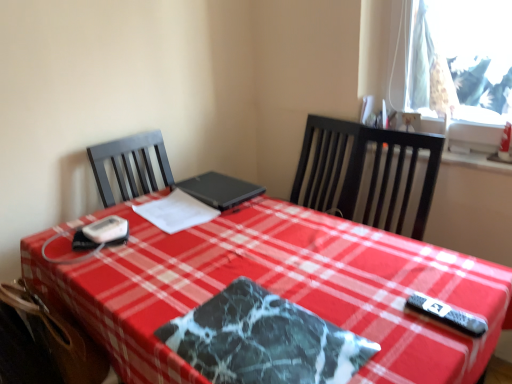
This screenshot has width=512, height=384. What do you see at coordinates (219, 190) in the screenshot? I see `black matte laptop at center` at bounding box center [219, 190].

What do you see at coordinates (176, 212) in the screenshot?
I see `white paper at center` at bounding box center [176, 212].

Locate an element on the screen. This screenshot has width=512, height=384. black matte laptop at center is located at coordinates (219, 190).

Looking at this image, who is smaller, marble-patterned placemat at center or black matte laptop at center?

marble-patterned placemat at center is smaller.

Between marble-patterned placemat at center and black matte laptop at center, which one has more height?

With more height is black matte laptop at center.

From the image's perspective, is marble-patterned placemat at center beneath black matte laptop at center?

Yes, from the image's perspective, marble-patterned placemat at center is beneath black matte laptop at center.

Is marble-patterned placemat at center to the right of black matte laptop at center from the viewer's perspective?

Correct, you'll find marble-patterned placemat at center to the right of black matte laptop at center.

Is marble-patterned placemat at center inside the boundaries of white paper at center, or outside?

marble-patterned placemat at center is spatially situated outside white paper at center.

What's the angular difference between marble-patterned placemat at center and white paper at center's facing directions?

83.1 degrees separate the facing orientations of marble-patterned placemat at center and white paper at center.

From a real-world perspective, is marble-patterned placemat at center positioned above or below white paper at center?

marble-patterned placemat at center is below white paper at center.

Looking at their sizes, would you say white paper at center is wider or thinner than black matte laptop at center?

Considering their sizes, white paper at center looks slimmer than black matte laptop at center.

Can we say white paper at center lies outside black matte laptop at center?

Yes, white paper at center is located beyond the bounds of black matte laptop at center.

From a real-world perspective, is white paper at center positioned above or below black matte laptop at center?

white paper at center is situated lower than black matte laptop at center in the real world.

From the image's perspective, is marble-patterned placemat at center below brown leather swivel chair at lower left?

No, from the image's perspective, marble-patterned placemat at center is not below brown leather swivel chair at lower left.

Is marble-patterned placemat at center not close to brown leather swivel chair at lower left?

That's not correct — marble-patterned placemat at center is a little close to brown leather swivel chair at lower left.

Image resolution: width=512 pixels, height=384 pixels. Identify the location of place mat that appears above the brown leather swivel chair at lower left (from the image's perspective). (264, 340).

Who is smaller, marble-patterned placemat at center or brown leather swivel chair at lower left?

With smaller size is marble-patterned placemat at center.

At what (x,y) coordinates should I click in order to perform the action: click on swivel chair below the black matte laptop at center (from the image's perspective). Please return your answer as a coordinate pair (x, y). This screenshot has height=384, width=512. Looking at the image, I should click on (42, 344).

From the image's perspective, which object appears higher, brown leather swivel chair at lower left or black matte laptop at center?

black matte laptop at center appears higher in the image.

What's the angular difference between brown leather swivel chair at lower left and black matte laptop at center's facing directions?

The angular difference between brown leather swivel chair at lower left and black matte laptop at center is 90 degrees.

Which point is more forward, (x=72, y=359) or (x=238, y=184)?

The point (x=72, y=359) is closer.

Can you confirm if brown leather swivel chair at lower left is positioned to the left of marble-patterned placemat at center?

Indeed, brown leather swivel chair at lower left is positioned on the left side of marble-patterned placemat at center.

Does brown leather swivel chair at lower left contain marble-patterned placemat at center?

No, marble-patterned placemat at center is not inside brown leather swivel chair at lower left.

Is point (25, 357) less distant than point (361, 342)?

No, it is not.

Is brown leather swivel chair at lower left positioned with its back to marble-patterned placemat at center?

No.

Which of these two, white paper at center or marble-patterned placemat at center, is smaller?

With smaller size is white paper at center.

Could you tell me if white paper at center is turned towards marble-patterned placemat at center?

Yes, white paper at center is turned towards marble-patterned placemat at center.

Considering the sizes of objects white paper at center and marble-patterned placemat at center in the image provided, who is thinner, white paper at center or marble-patterned placemat at center?

Thinner between the two is marble-patterned placemat at center.

Identify the location of laptop located behind the marble-patterned placemat at center. (219, 190).

This screenshot has width=512, height=384. I want to click on place mat in front of the white paper at center, so click(x=264, y=340).

From the image, which object appears to be farther from brown leather swivel chair at lower left, white paper at center or black matte laptop at center?

Based on the image, black matte laptop at center appears to be further to brown leather swivel chair at lower left.

Considering their positions, is black matte laptop at center positioned closer to white paper at center than brown leather swivel chair at lower left?

The object closer to white paper at center is black matte laptop at center.

Which object lies further to the anchor point white paper at center, brown leather swivel chair at lower left or black matte laptop at center?

Among the two, brown leather swivel chair at lower left is located further to white paper at center.

Based on their spatial positions, is brown leather swivel chair at lower left or white paper at center closer to black matte laptop at center?

white paper at center.

Considering their positions, is black matte laptop at center positioned further to brown leather swivel chair at lower left than marble-patterned placemat at center?

Among the two, black matte laptop at center is located further to brown leather swivel chair at lower left.

Considering their positions, is white paper at center positioned closer to brown leather swivel chair at lower left than marble-patterned placemat at center?

marble-patterned placemat at center is closer to brown leather swivel chair at lower left.

Considering their positions, is white paper at center positioned closer to black matte laptop at center than brown leather swivel chair at lower left?

white paper at center is closer to black matte laptop at center.

From the image, which object appears to be nearer to white paper at center, brown leather swivel chair at lower left or marble-patterned placemat at center?

The object closer to white paper at center is brown leather swivel chair at lower left.

Identify the location of swivel chair between marble-patterned placemat at center and black matte laptop at center in the front-back direction. (42, 344).

The width and height of the screenshot is (512, 384). What are the coordinates of `swivel chair positioned between marble-patterned placemat at center and white paper at center from near to far` in the screenshot? It's located at (42, 344).

Locate an element on the screen. linen positioned between brown leather swivel chair at lower left and black matte laptop at center from near to far is located at coordinates (176, 212).

In order to click on linen positioned between marble-patterned placemat at center and black matte laptop at center from near to far in this screenshot , I will do `click(176, 212)`.